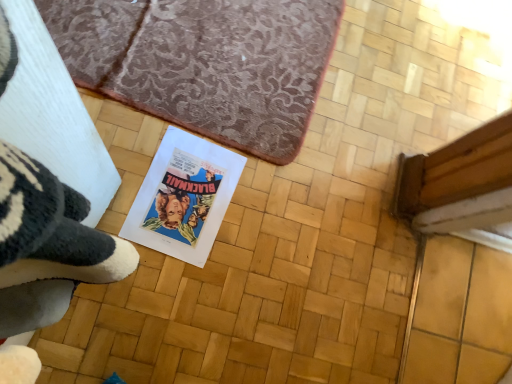
Locate an element on the screen. vacant space to the right of brown textured rug at upper center is located at coordinates (325, 188).